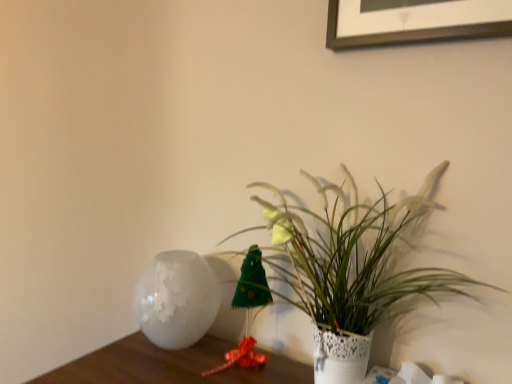
Describe the element at coordinates (351, 268) in the screenshot. I see `white textured vase at center` at that location.

This screenshot has height=384, width=512. What are the coordinates of `white textured vase at center` in the screenshot? It's located at (351, 268).

What are the coordinates of `white frosted vase at left` in the screenshot? It's located at (176, 299).

What is the approximate width of white frosted vase at left?

7.62 inches.

What do you see at coordinates (176, 299) in the screenshot? The height and width of the screenshot is (384, 512). I see `white frosted vase at left` at bounding box center [176, 299].

Image resolution: width=512 pixels, height=384 pixels. Find the location of `white textured vase at center`. white textured vase at center is located at coordinates (351, 268).

Which object is positioned more to the left, white textured vase at center or white frosted vase at left?

Positioned to the left is white frosted vase at left.

Which object is closer to the camera taking this photo, white textured vase at center or white frosted vase at left?

white textured vase at center is more forward.

Is point (272, 240) more distant than point (207, 316)?

No, (272, 240) is in front of (207, 316).

From the image's perspective, is white textured vase at center located above or below white frosted vase at left?

Clearly, from the image's perspective, white textured vase at center is above white frosted vase at left.

From a real-world perspective, is white textured vase at center located beneath white frosted vase at left?

Incorrect, from a real-world perspective, white textured vase at center is higher than white frosted vase at left.

Does white textured vase at center have a lesser width compared to white frosted vase at left?

Indeed, white textured vase at center has a lesser width compared to white frosted vase at left.

Does white textured vase at center have a lesser height compared to white frosted vase at left?

In fact, white textured vase at center may be taller than white frosted vase at left.

Considering the relative sizes of white textured vase at center and white frosted vase at left in the image provided, is white textured vase at center bigger than white frosted vase at left?

Yes.

Is white frosted vase at left located within white textured vase at center?

Definitely not — white frosted vase at left is not inside white textured vase at center.

Is white textured vase at center positioned far away from white frosted vase at left?

No.

Is white textured vase at center oriented towards white frosted vase at left?

No, white textured vase at center is not aimed at white frosted vase at left.

The width and height of the screenshot is (512, 384). I want to click on vase behind the white textured vase at center, so click(x=176, y=299).

Which object is positioned more to the left, white frosted vase at left or white textured vase at center?

white frosted vase at left is more to the left.

Consider the image. Is white frosted vase at left in front of white textured vase at center?

No, it is behind white textured vase at center.

Considering the points (176, 287) and (357, 222), which point is behind, point (176, 287) or point (357, 222)?

Positioned behind is point (176, 287).

From the image's perspective, is white frosted vase at left on white textured vase at center?

Actually, white frosted vase at left appears below white textured vase at center in the image.

From a real-world perspective, is white frosted vase at left on white textured vase at center?

No.

Which object is thinner, white frosted vase at left or white textured vase at center?

white textured vase at center.

Can you confirm if white frosted vase at left is shorter than white textured vase at center?

Correct, white frosted vase at left is not as tall as white textured vase at center.

Considering the relative sizes of white frosted vase at left and white textured vase at center in the image provided, is white frosted vase at left smaller than white textured vase at center?

Yes.

Does white frosted vase at left contain white textured vase at center?

That's incorrect, white textured vase at center is not inside white frosted vase at left.

Based on the photo, is white frosted vase at left not close to white textured vase at center?

No, there isn't a large distance between white frosted vase at left and white textured vase at center.

Does white frosted vase at left turn towards white textured vase at center?

No, white frosted vase at left is not oriented towards white textured vase at center.

This screenshot has width=512, height=384. In order to click on houseplant above the white frosted vase at left (from the image's perspective) in this screenshot , I will do `click(351, 268)`.

The height and width of the screenshot is (384, 512). I want to click on vase below the white textured vase at center (from the image's perspective), so click(x=176, y=299).

This screenshot has height=384, width=512. In order to click on vase behind the white textured vase at center in this screenshot , I will do `click(176, 299)`.